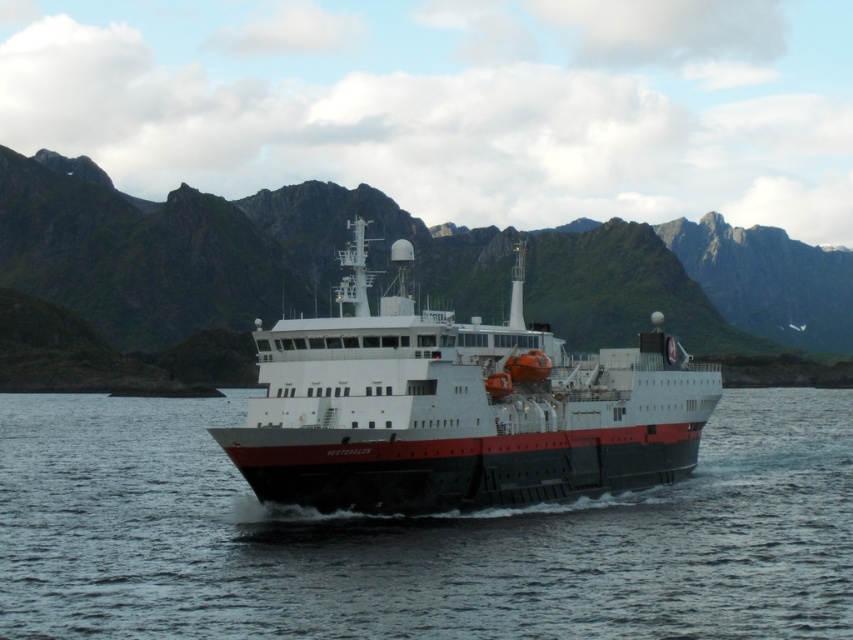
Question: Considering the relative positions of black water at center and white matte ship at center in the image provided, where is black water at center located with respect to white matte ship at center?

Choices:
 (A) right
 (B) left

Answer: (A)

Question: Which point is farther to the camera?

Choices:
 (A) (273, 429)
 (B) (119, 364)

Answer: (B)

Question: Which is farther from the black water at center?

Choices:
 (A) green grassy mountain at center
 (B) white matte ship at center

Answer: (A)

Question: Does green grassy mountain at center have a lesser width compared to white matte ship at center?

Choices:
 (A) no
 (B) yes

Answer: (A)

Question: Which point is closer to the camera?

Choices:
 (A) black water at center
 (B) green grassy mountain at center
 (C) white matte ship at center

Answer: (A)

Question: Can you confirm if black water at center is smaller than white matte ship at center?

Choices:
 (A) no
 (B) yes

Answer: (A)